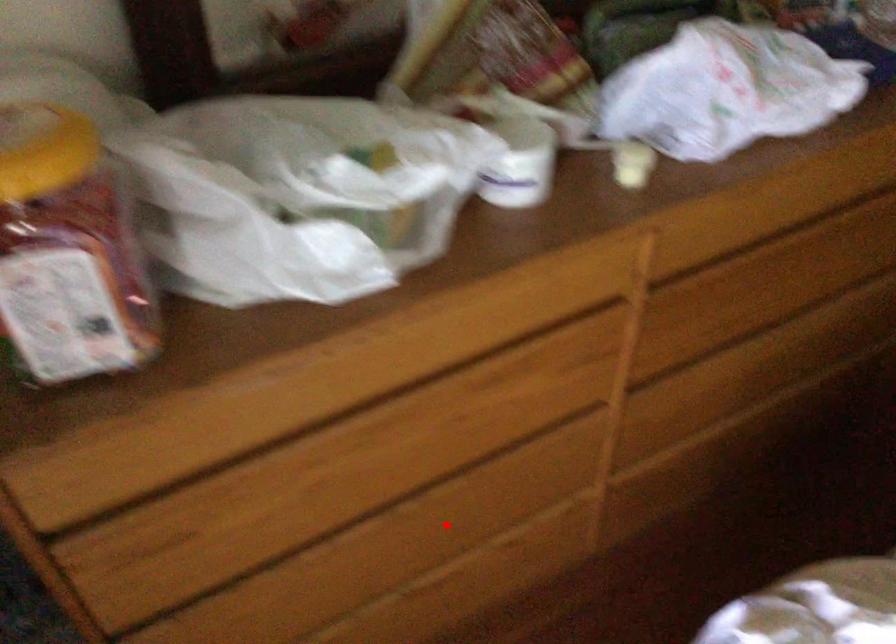
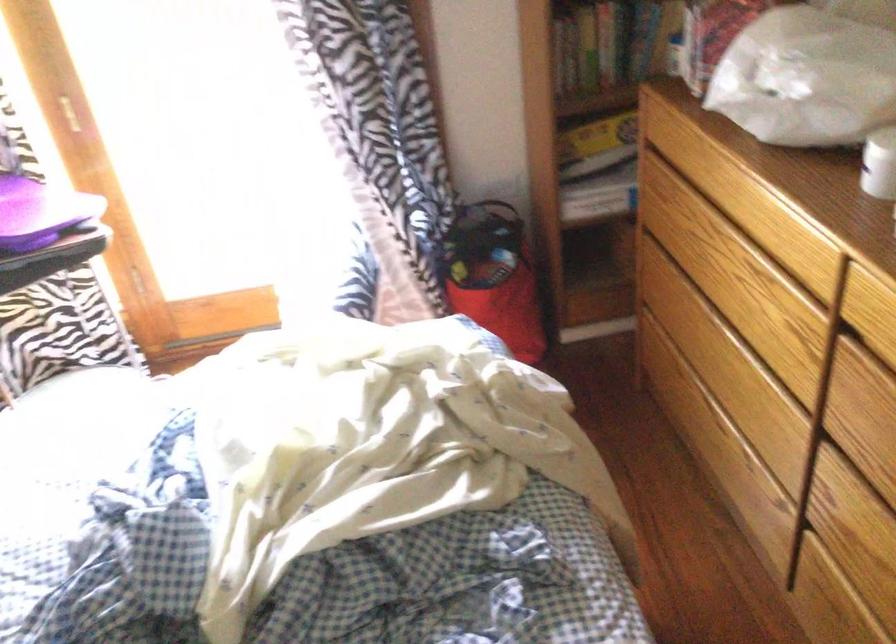
Find the pixel in the second image that matches the highlighted location in the first image.

(719, 355)